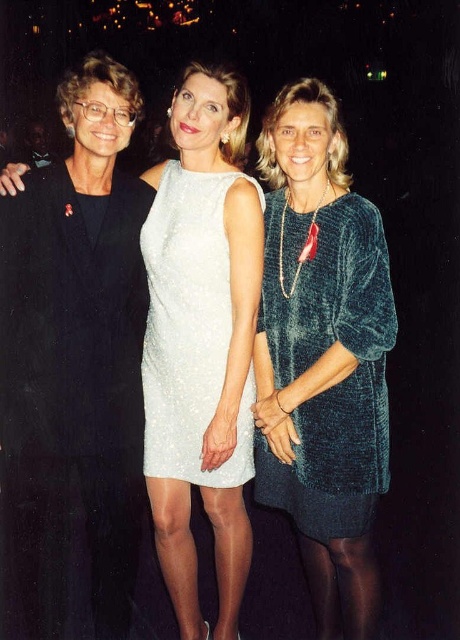
Is velvet green dress at center taller than white sequined dress at center?

Yes, velvet green dress at center is taller than white sequined dress at center.

Is velvet green dress at center to the left of white sequined dress at center from the viewer's perspective?

In fact, velvet green dress at center is to the right of white sequined dress at center.

At what (x,y) coordinates should I click in order to perform the action: click on velvet green dress at center. Please return your answer as a coordinate pair (x, y). The image size is (460, 640). Looking at the image, I should click on (322, 355).